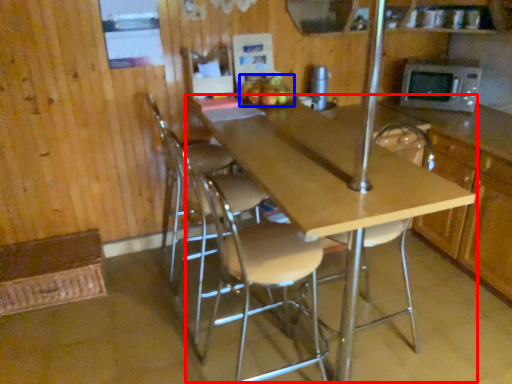
Question: Which object is closer to the camera taking this photo, table (highlighted by a red box) or apple (highlighted by a blue box)?

Choices:
 (A) table
 (B) apple

Answer: (A)